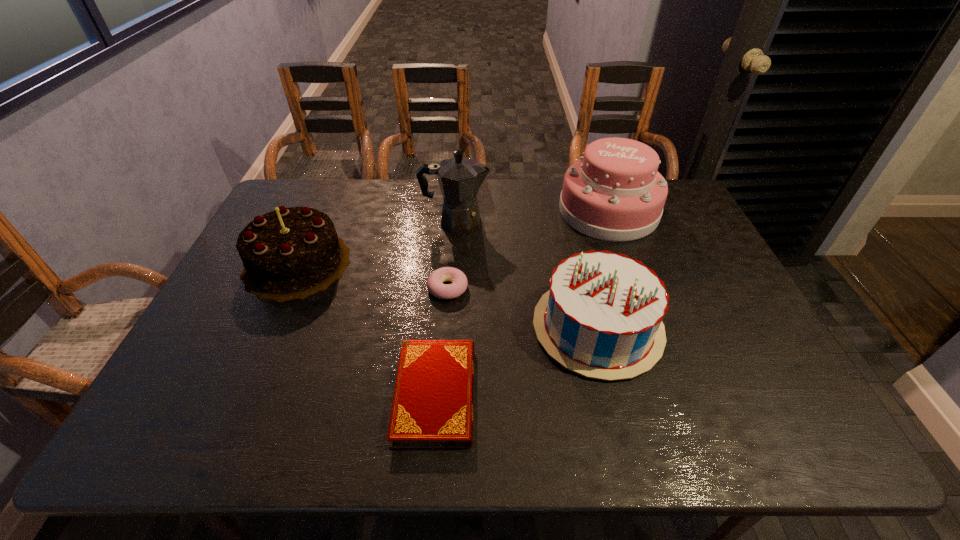
The height and width of the screenshot is (540, 960). What are the coordinates of `coffeepot` in the screenshot? It's located at (460, 178).

Identify the location of the leftmost birthday cake. The width and height of the screenshot is (960, 540). (290, 253).

Locate an element on the screen. This screenshot has width=960, height=540. doughnut is located at coordinates (435, 286).

Find the location of a particular element. This screenshot has width=960, height=540. hardback book is located at coordinates (433, 402).

What are the coordinates of `vacant space located 0.270m on the pouring side of the coffeepot` in the screenshot? It's located at (572, 221).

At what (x,y) coordinates should I click in order to perform the action: click on vacant position located on the front of the leftmost birthday cake. Please return your answer as a coordinate pair (x, y). This screenshot has width=960, height=540. Looking at the image, I should click on (217, 444).

Find the location of `vacant region located 0.370m on the front of the doughnut`. vacant region located 0.370m on the front of the doughnut is located at coordinates (437, 431).

Locate an element on the screen. This screenshot has height=540, width=960. coffeepot that is at the far edge is located at coordinates click(x=460, y=178).

What are the coordinates of `birthday cake that is at the far edge` in the screenshot? It's located at (614, 192).

Where is `object positioned at the near edge`? object positioned at the near edge is located at coordinates (433, 402).